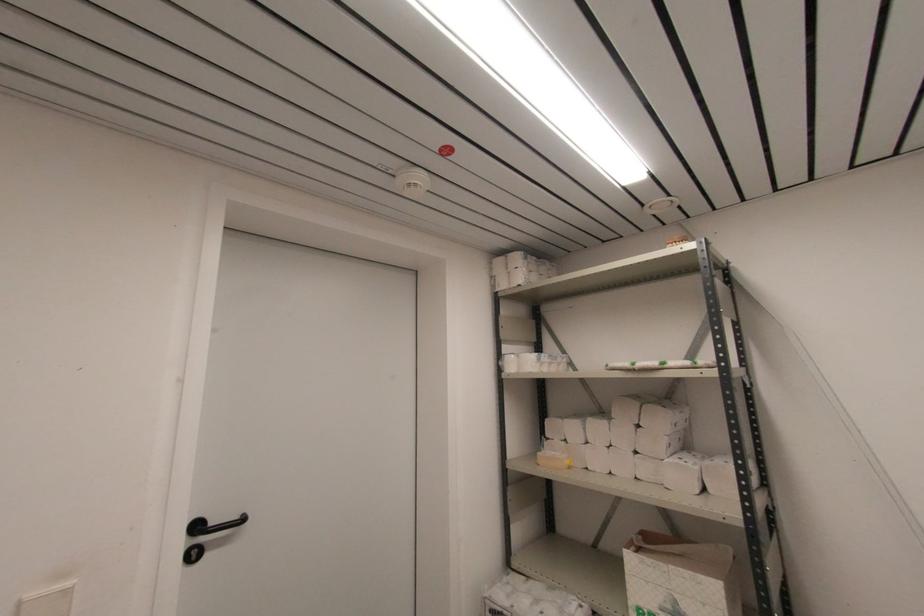
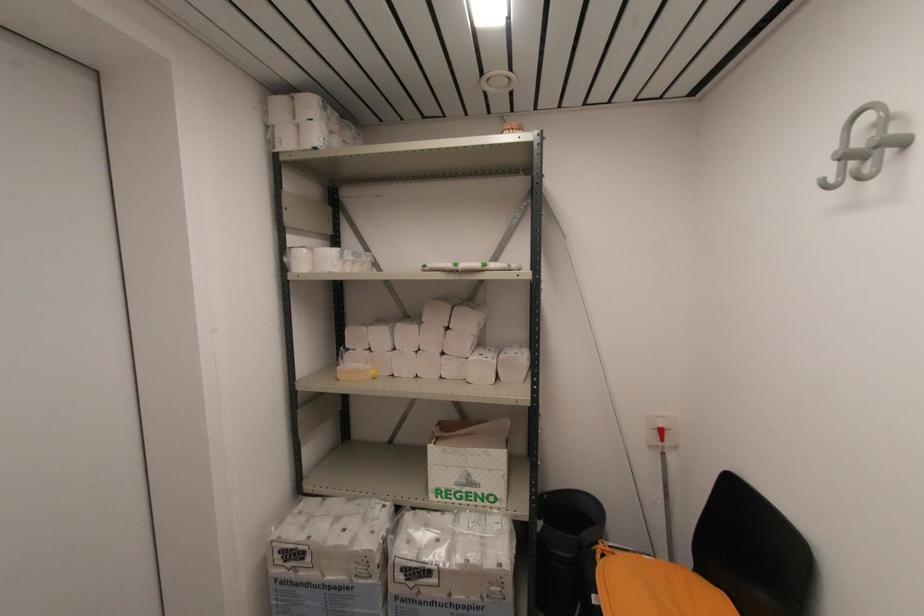
The point at (550, 359) is marked in the first image. Where is the corresponding point in the second image?

(353, 257)